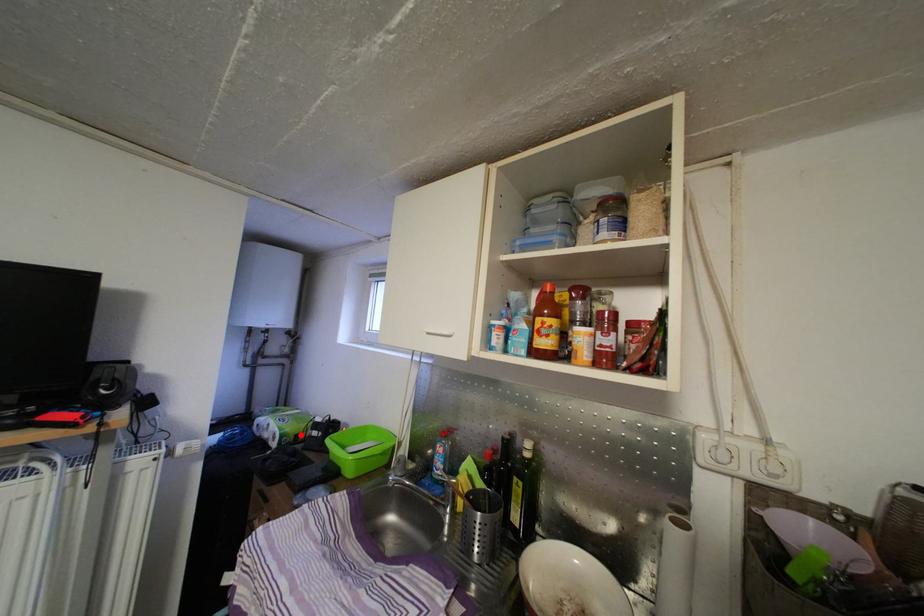
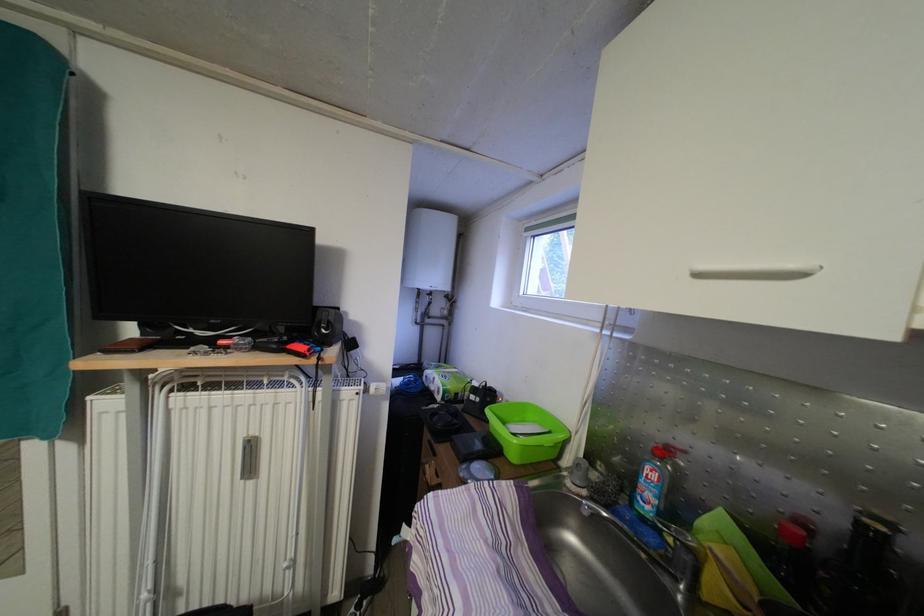
Find the pixel in the second image that matches the highlighted location in the first image.

(460, 394)